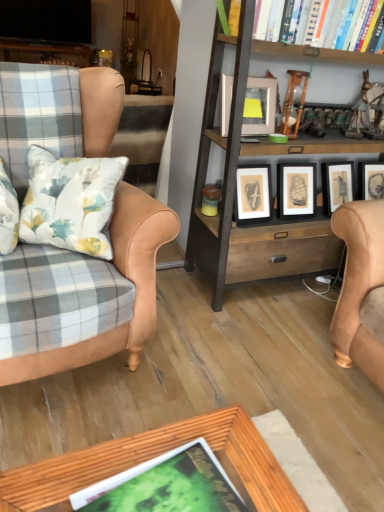
The width and height of the screenshot is (384, 512). What are the coordinates of `free point above green matte book at lower center, which ranks as the 2th book in top-to-bottom order (from a real-world perspective)` in the screenshot? It's located at (175, 484).